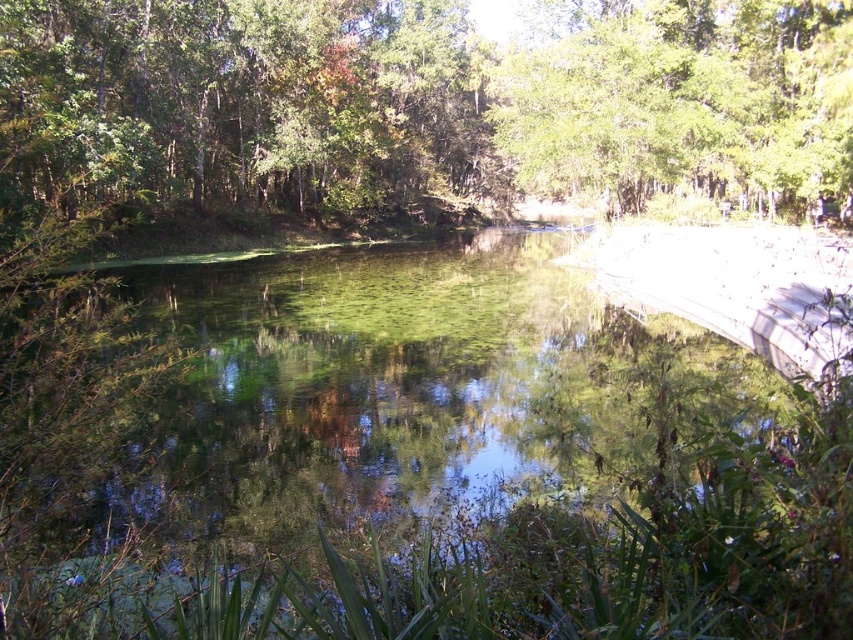
Is green reflective water at center wider than green leafy trees at upper center?

No.

Does green reflective water at center come in front of green leafy trees at upper center?

Yes, green reflective water at center is in front of green leafy trees at upper center.

Which is behind, point (837, 532) or point (207, 113)?

The point (207, 113) is behind.

The image size is (853, 640). In order to click on green reflective water at center in this screenshot , I will do `click(440, 458)`.

Does green reflective water at center have a lesser width compared to green leafy tree at upper center?

No, green reflective water at center is not thinner than green leafy tree at upper center.

Is green reflective water at center further to the viewer compared to green leafy tree at upper center?

No, it is not.

Measure the distance between green reflective water at center and camera.

green reflective water at center is 6.20 feet away from camera.

Identify the location of green reflective water at center. The image size is (853, 640). (440, 458).

Between point (405, 132) and point (828, 20), which one is positioned behind?

The point (405, 132) is behind.

Who is positioned more to the left, green leafy trees at upper center or green leafy tree at upper center?

Positioned to the left is green leafy trees at upper center.

What do you see at coordinates (426, 99) in the screenshot?
I see `green leafy trees at upper center` at bounding box center [426, 99].

This screenshot has width=853, height=640. What are the coordinates of `green leafy trees at upper center` in the screenshot? It's located at (426, 99).